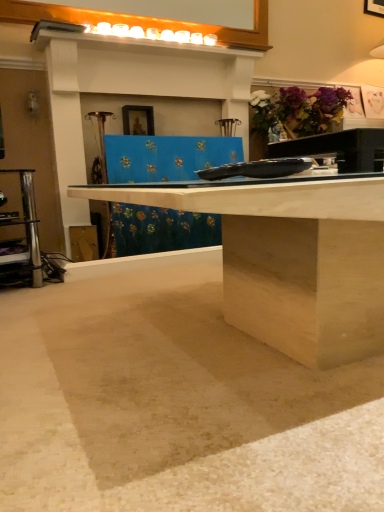
Question: From a real-world perspective, is beige matte concrete at lower center above or below purple matte flower at upper right?

Choices:
 (A) above
 (B) below

Answer: (B)

Question: Considering the positions of beige matte concrete at lower center and purple matte flower at upper right in the image, is beige matte concrete at lower center wider or thinner than purple matte flower at upper right?

Choices:
 (A) thin
 (B) wide

Answer: (B)

Question: Which object is the closest to the purple matte flower at upper right?

Choices:
 (A) beige matte concrete at lower center
 (B) wooden framed picture at upper center

Answer: (B)

Question: Which is farther from the beige matte concrete at lower center?

Choices:
 (A) purple matte flower at upper right
 (B) wooden framed picture at upper center

Answer: (A)